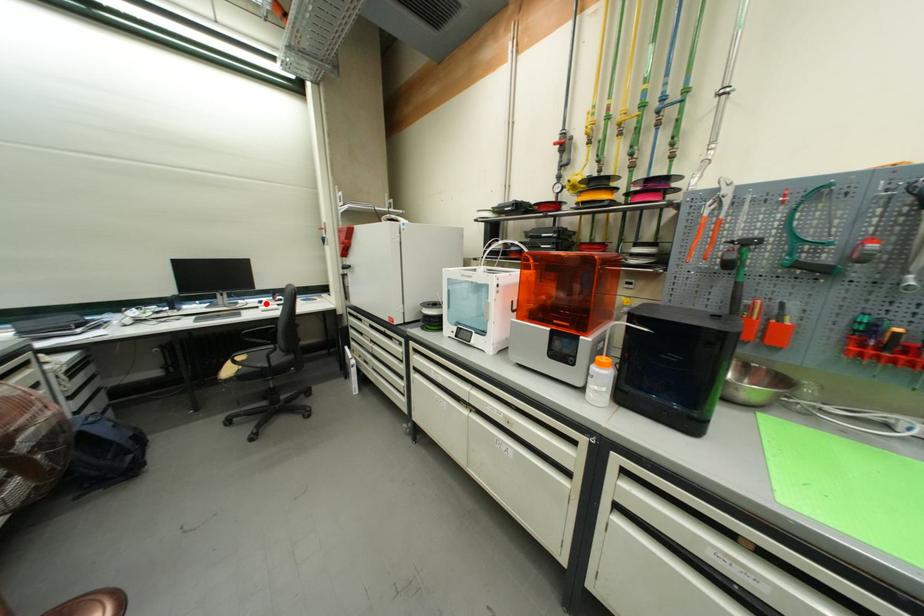
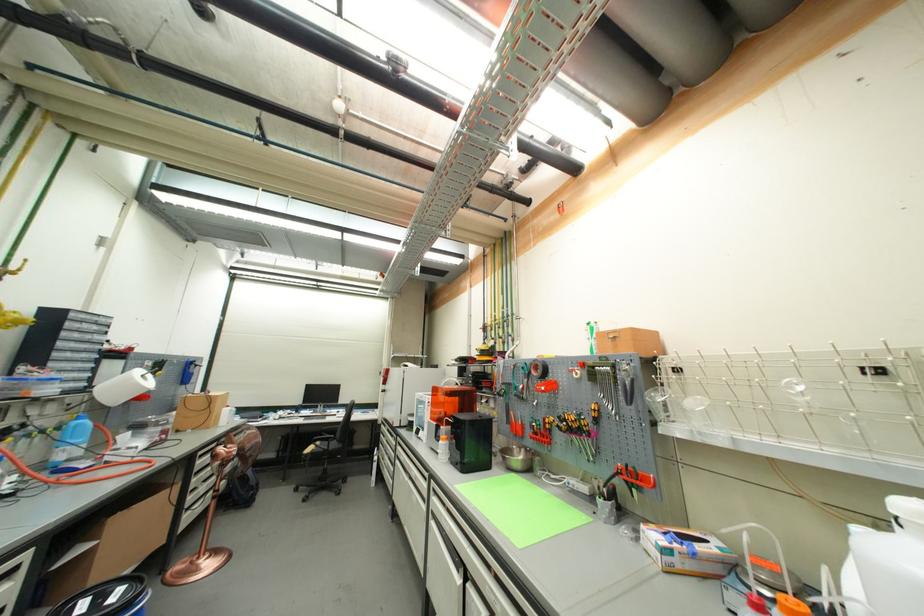
Question: I am providing you with two images of the same scene from different viewpoints. A red point is marked on the first image. Can you still see the location of the red point in image 2?

Choices:
 (A) Yes
 (B) No

Answer: (A)